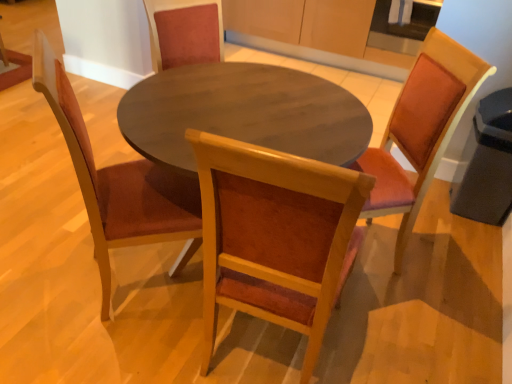
Question: From the image's perspective, is wooden chair at center, marked as the second chair in a right-to-left arrangement, positioned above or below wooden chair at right, marked as the first chair in a right-to-left arrangement?

Choices:
 (A) below
 (B) above

Answer: (A)

Question: Is wooden chair at center, marked as the second chair in a right-to-left arrangement, to the left or to the right of wooden chair at right, marked as the first chair in a right-to-left arrangement, in the image?

Choices:
 (A) right
 (B) left

Answer: (B)

Question: Which is farther from the wooden chair at right, marked as the first chair in a right-to-left arrangement?

Choices:
 (A) wooden chair at center, the 2th chair from the left
 (B) wooden chair at left, arranged as the third chair when viewed from the right

Answer: (B)

Question: Considering the real-world distances, which object is farthest from the wooden chair at right, marked as the first chair in a right-to-left arrangement?

Choices:
 (A) wooden chair at left, arranged as the third chair when viewed from the right
 (B) wooden chair at center, the 2th chair from the left

Answer: (A)